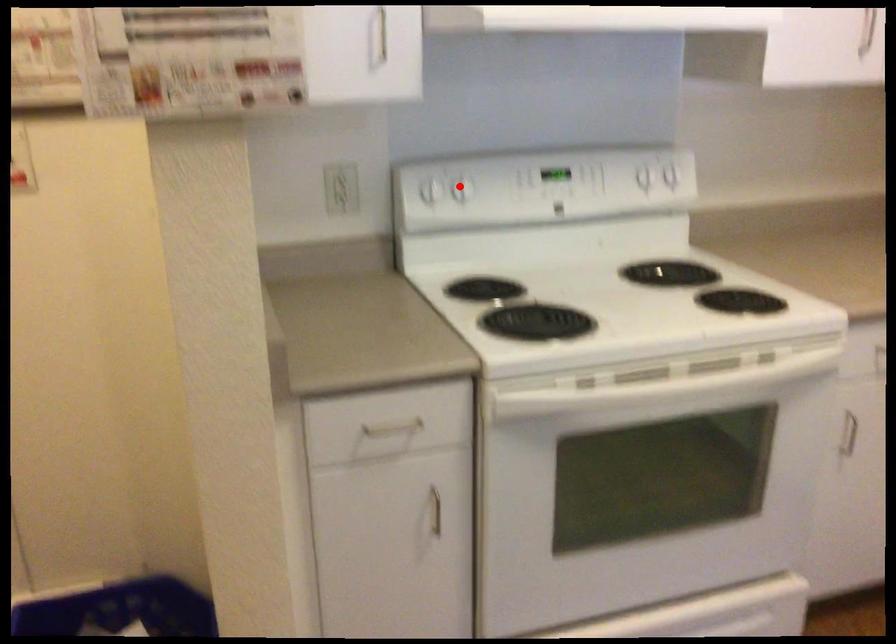
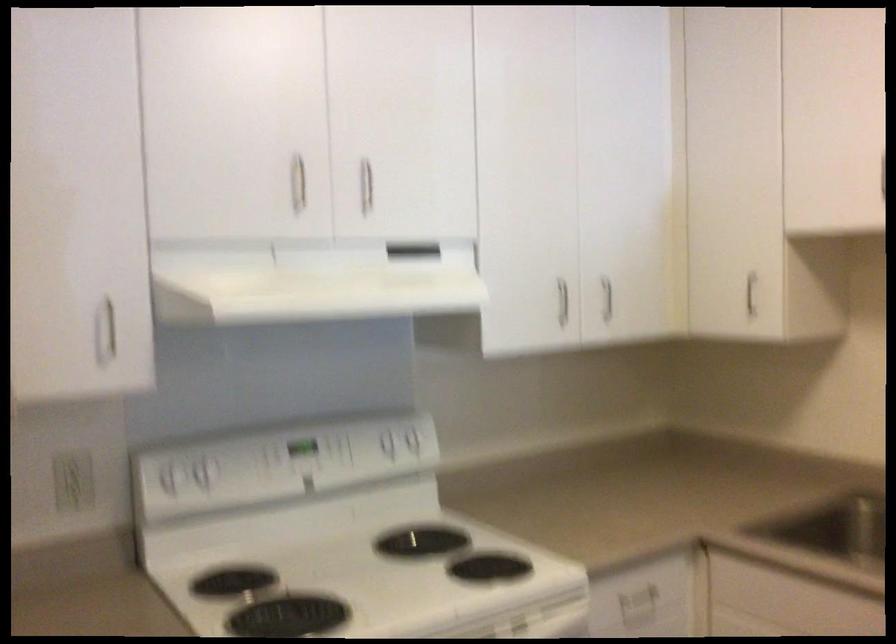
Question: I am providing you with two images of the same scene from different viewpoints. A red point is marked on the first image. At the location where the point appears in image 1, is it still visible in image 2?

Choices:
 (A) Yes
 (B) No

Answer: (A)